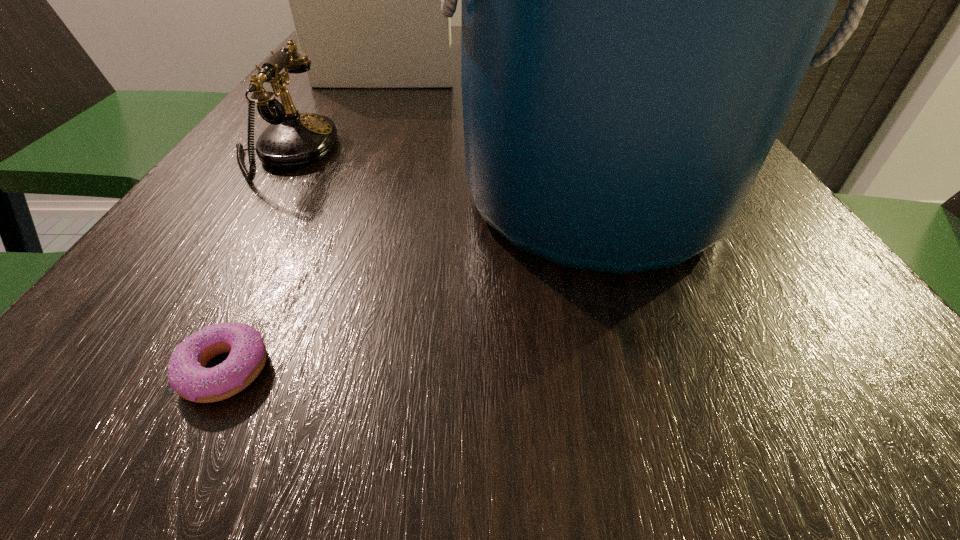
Locate an element on the screen. object located at the near edge is located at coordinates (187, 375).

The image size is (960, 540). I want to click on cake present at the left edge, so click(x=365, y=0).

Identify the location of telephone that is at the left edge. (292, 140).

This screenshot has height=540, width=960. I want to click on doughnut that is positioned at the left edge, so click(187, 375).

Locate an element on the screen. The height and width of the screenshot is (540, 960). object that is positioned at the right edge is located at coordinates (641, 0).

I want to click on object located in the far left corner section of the desktop, so click(365, 0).

You are a GUI agent. You are given a task and a screenshot of the screen. Output one action in this format:
    pyautogui.click(x=<x>, y=<y>)
    Task: Click on the object at the near left corner
    Image resolution: width=960 pixels, height=540 pixels.
    Given the screenshot: What is the action you would take?
    pos(187,375)

I want to click on free space at the far edge of the desktop, so click(x=452, y=37).

In the image, there is a desktop. Identify the location of vacant space at the near edge. The height and width of the screenshot is (540, 960). (562, 431).

Find the location of a particular element. The width and height of the screenshot is (960, 540). free spot at the left edge of the desktop is located at coordinates (321, 96).